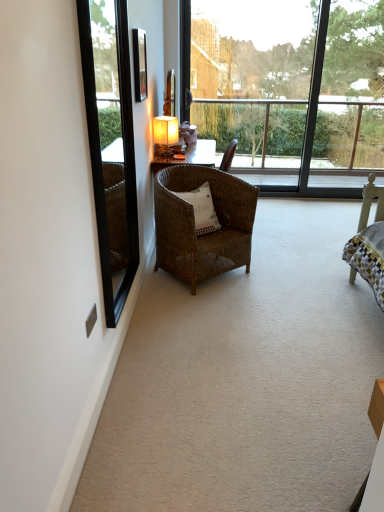
The width and height of the screenshot is (384, 512). What are the coordinates of `empty space that is to the right of woven brown chair at center` in the screenshot? It's located at (284, 273).